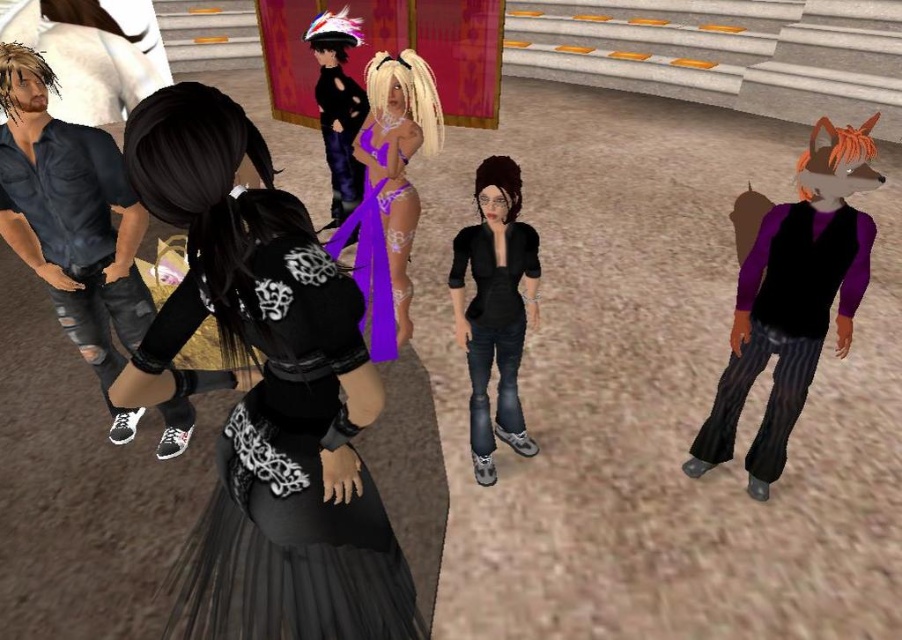
You are an avatar trying to see the shiny black dress at center behind the matte purple vest at center. Can you see it fully from your current position?

The matte purple vest at center is in front of the shiny black dress at center, so you cannot see the shiny black dress at center fully from your current position.

You are an avatar in the virtual environment and want to know which dress is shorter between the black satin dress at center and the lace purple dress at center. Which one is shorter?

The black satin dress at center is shorter than the lace purple dress at center.